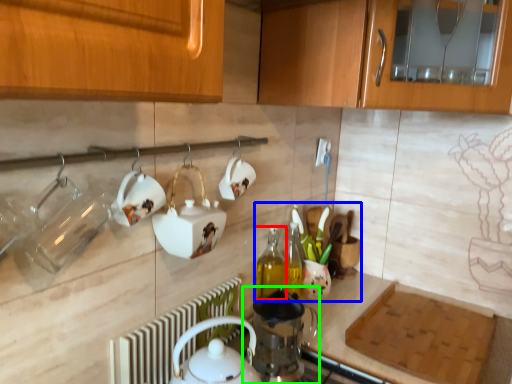
Question: Which object is positioned farthest from bottle (highlighted by a red box)? Select from tea set (highlighted by a blue box) and appliance (highlighted by a green box).

Choices:
 (A) tea set
 (B) appliance

Answer: (B)